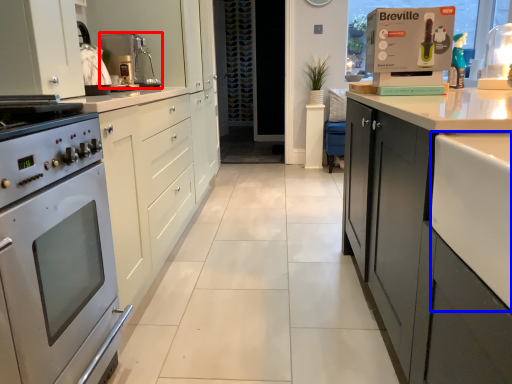
Question: Which of the following is the closest to the observer, kitchen appliance (highlighted by a red box) or counter top (highlighted by a blue box)?

Choices:
 (A) kitchen appliance
 (B) counter top

Answer: (B)